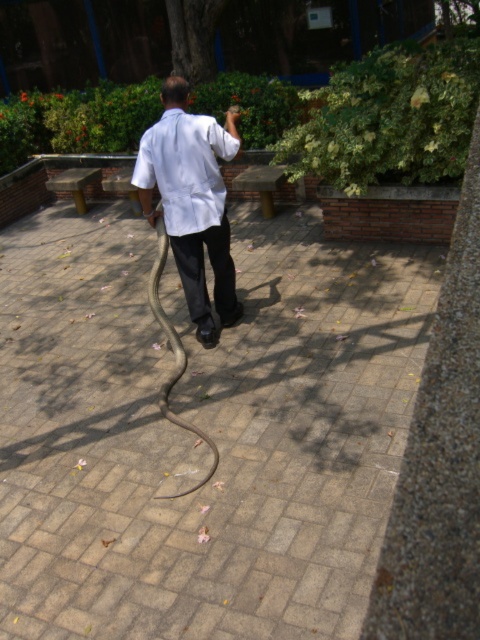
Is white matte dress shirt at center above shiny black snake at center?

Correct, white matte dress shirt at center is located above shiny black snake at center.

Where is `white matte dress shirt at center`? This screenshot has height=640, width=480. white matte dress shirt at center is located at coordinates (186, 168).

Where is `white matte dress shirt at center`? The image size is (480, 640). white matte dress shirt at center is located at coordinates (186, 168).

Is point (2, 570) positioned in front of point (220, 205)?

Yes, point (2, 570) is closer to viewer.

This screenshot has height=640, width=480. In order to click on brick paved ground at center in this screenshot , I will do `click(203, 429)`.

In order to click on brick paved ground at center in this screenshot , I will do `click(203, 429)`.

Is brick paved ground at center closer to camera compared to shiny black snake at center?

Yes.

Is point (327, 257) farther from viewer compared to point (152, 273)?

That is True.

You are a GUI agent. You are given a task and a screenshot of the screen. Output one action in this format:
    pyautogui.click(x=<x>, y=<y>)
    Task: Click on the brick paved ground at center
    This screenshot has height=640, width=480.
    Given the screenshot: What is the action you would take?
    pyautogui.click(x=203, y=429)